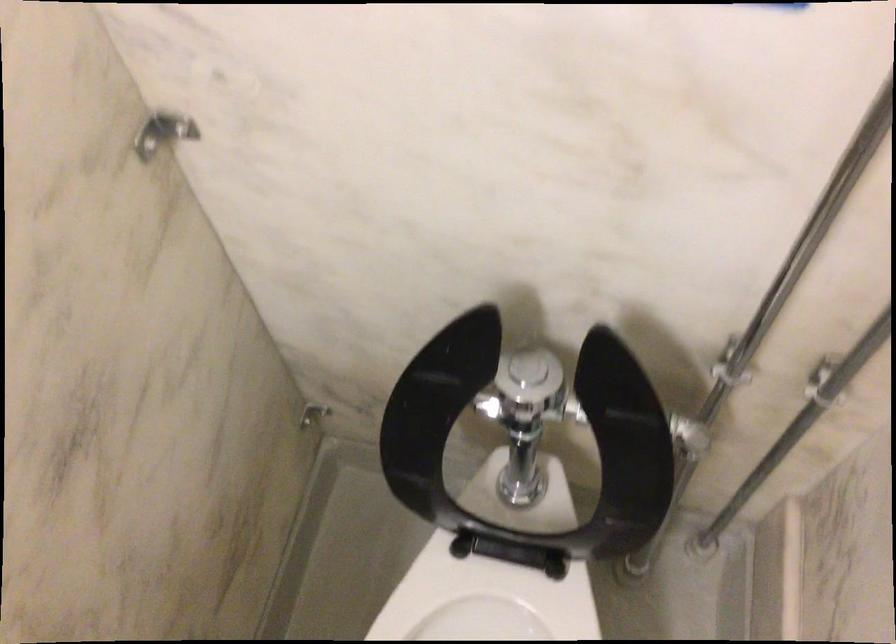
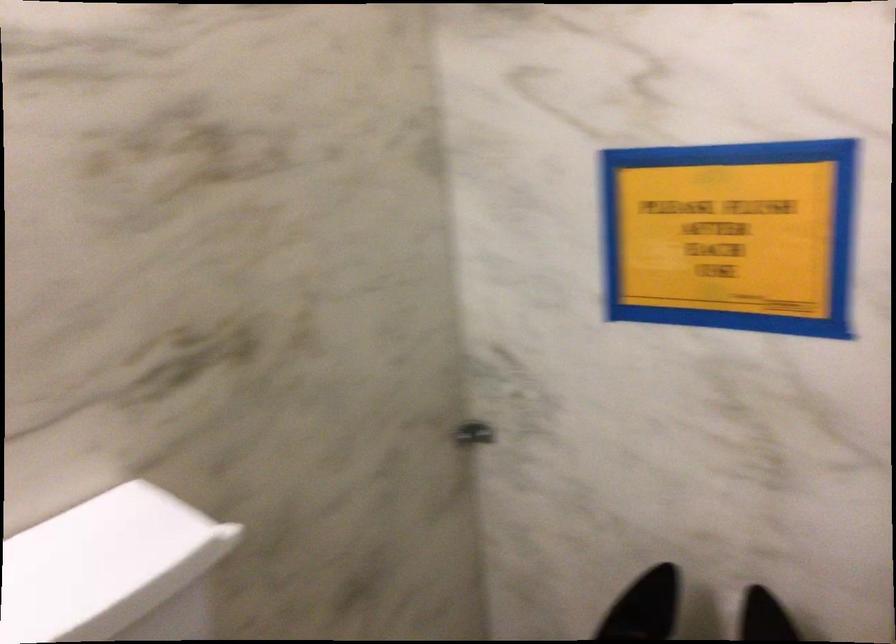
From the picture: The images are taken continuously from a first-person perspective. In which direction is your viewpoint rotating?

The camera rotated toward left-up.